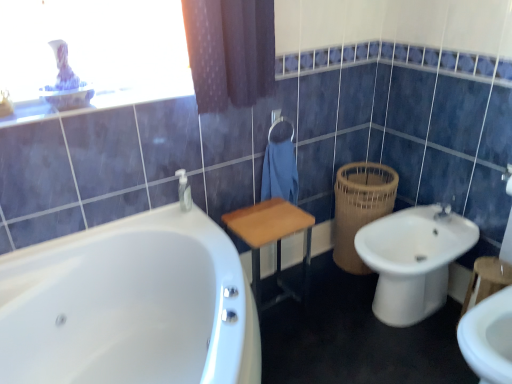
This screenshot has width=512, height=384. Identify the location of vacant area that lies in front of translucent plastic soap dispenser at center. (190, 218).